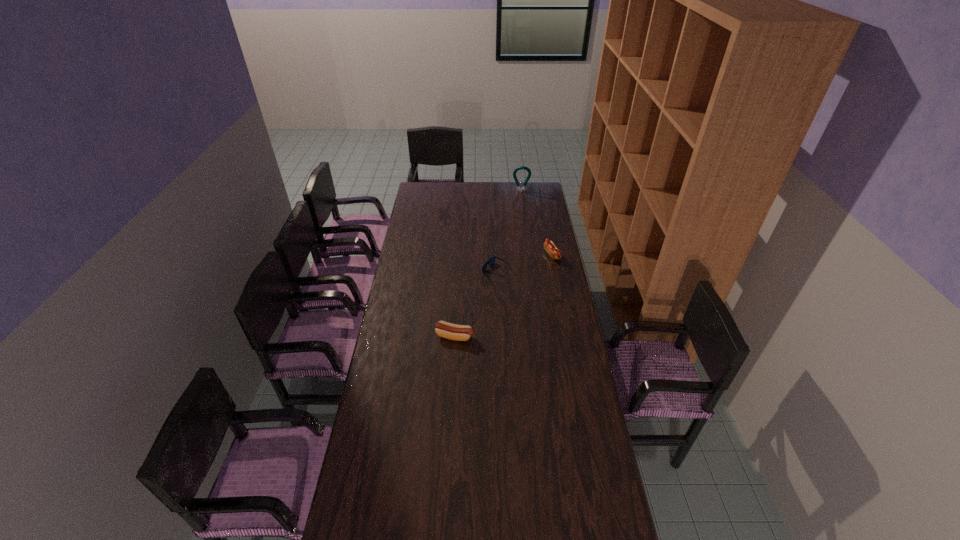
The height and width of the screenshot is (540, 960). What are the coordinates of `bottle opener` in the screenshot? It's located at (522, 189).

Locate an element on the screen. The image size is (960, 540). the tallest object is located at coordinates click(x=522, y=189).

At what (x,y) coordinates should I click in order to perform the action: click on the right sausage. Please return your answer as a coordinate pair (x, y). Image resolution: width=960 pixels, height=540 pixels. Looking at the image, I should click on (549, 246).

Where is `the farther sausage`? This screenshot has height=540, width=960. the farther sausage is located at coordinates (549, 246).

The image size is (960, 540). What are the coordinates of `the leftmost object` in the screenshot? It's located at (443, 329).

At what (x,y) coordinates should I click in order to perform the action: click on the left sausage. Please return your answer as a coordinate pair (x, y). Image resolution: width=960 pixels, height=540 pixels. Looking at the image, I should click on (443, 329).

Locate an element on the screen. This screenshot has height=540, width=960. the shortest object is located at coordinates (492, 260).

You are a GUI agent. You are given a task and a screenshot of the screen. Output one action in this format:
    pyautogui.click(x=<x>, y=<y>)
    Task: Click on the third object from right to left
    
    Given the screenshot: What is the action you would take?
    pyautogui.click(x=492, y=260)

Locate an element on the screen. The image size is (960, 540). free space located 0.110m at the jaws of the farthest object is located at coordinates (522, 202).

Identify the location of vacant space situated on the back of the right sausage. click(549, 240).